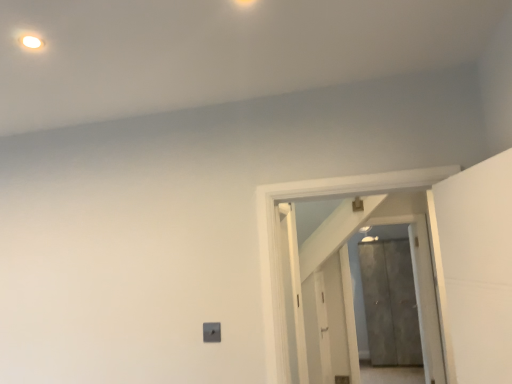
Question: Which direction should I rotate to look at white wooden door at center, acting as the 1th door starting from the front?

Choices:
 (A) left
 (B) right

Answer: (B)

Question: From the image's perspective, is white wooden door at center, the second door positioned from the back, on top of metallic gray door at center, acting as the 1th door starting from the bottom?

Choices:
 (A) no
 (B) yes

Answer: (B)

Question: Is the depth of white wooden door at center, the second door positioned from the back, less than that of metallic gray door at center, which is the 1th door from right to left?

Choices:
 (A) no
 (B) yes

Answer: (B)

Question: Can you confirm if white wooden door at center, acting as the 1th door starting from the front, is bigger than metallic gray door at center, which is counted as the second door, starting from the front?

Choices:
 (A) yes
 (B) no

Answer: (B)

Question: Is white wooden door at center, marked as the second door in a bottom-to-top arrangement, turned away from metallic gray door at center, which is the second door in left-to-right order?

Choices:
 (A) yes
 (B) no

Answer: (A)

Question: Can you confirm if white wooden door at center, acting as the first door starting from the top, is positioned to the right of metallic gray door at center, which is counted as the second door, starting from the front?

Choices:
 (A) yes
 (B) no

Answer: (B)

Question: Is white wooden door at center, the 1th door in the left-to-right sequence, outside of metallic gray door at center, acting as the 1th door starting from the back?

Choices:
 (A) no
 (B) yes

Answer: (B)

Question: Is metallic gray door at center, which is the 1th door from right to left, behind white wooden door at center, which is counted as the 2th door, starting from the right?

Choices:
 (A) yes
 (B) no

Answer: (A)

Question: Does metallic gray door at center, acting as the 1th door starting from the bottom, have a smaller size compared to white wooden door at center, acting as the 1th door starting from the front?

Choices:
 (A) yes
 (B) no

Answer: (B)

Question: Is metallic gray door at center, which is the second door in left-to-right order, completely or partially outside of white wooden door at center, the 1th door in the left-to-right sequence?

Choices:
 (A) no
 (B) yes

Answer: (B)

Question: Does metallic gray door at center, which is the 1th door from right to left, appear on the right side of white wooden door at center, the 1th door in the left-to-right sequence?

Choices:
 (A) yes
 (B) no

Answer: (A)

Question: Considering the relative sizes of metallic gray door at center, acting as the 1th door starting from the back, and white wooden door at center, the 1th door in the left-to-right sequence, in the image provided, is metallic gray door at center, acting as the 1th door starting from the back, taller than white wooden door at center, the 1th door in the left-to-right sequence,?

Choices:
 (A) no
 (B) yes

Answer: (B)

Question: From a real-world perspective, is metallic gray door at center, marked as the second door in a top-to-bottom arrangement, positioned over white wooden door at center, marked as the second door in a bottom-to-top arrangement, based on gravity?

Choices:
 (A) no
 (B) yes

Answer: (A)

Question: Is point (339, 301) closer or farther from the camera than point (410, 256)?

Choices:
 (A) farther
 (B) closer

Answer: (B)